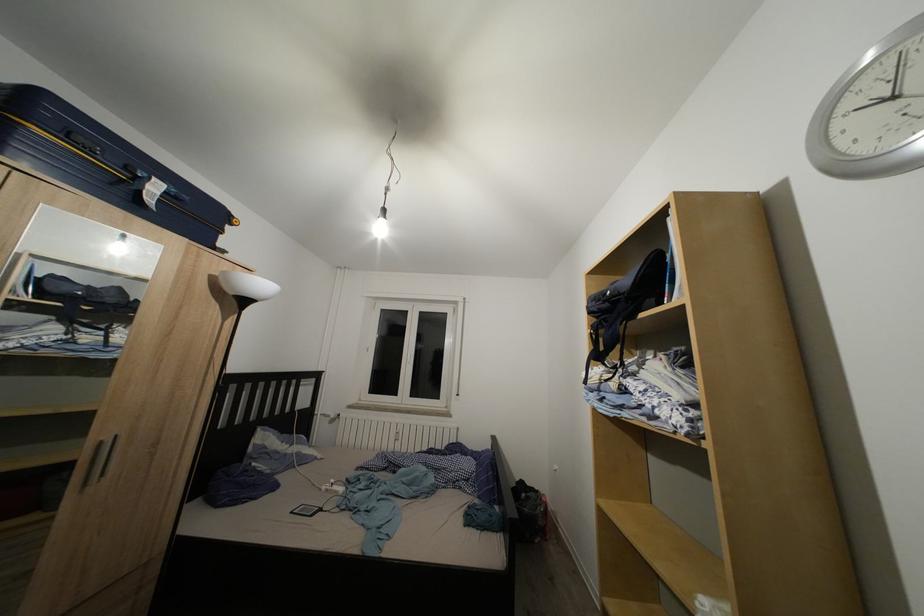
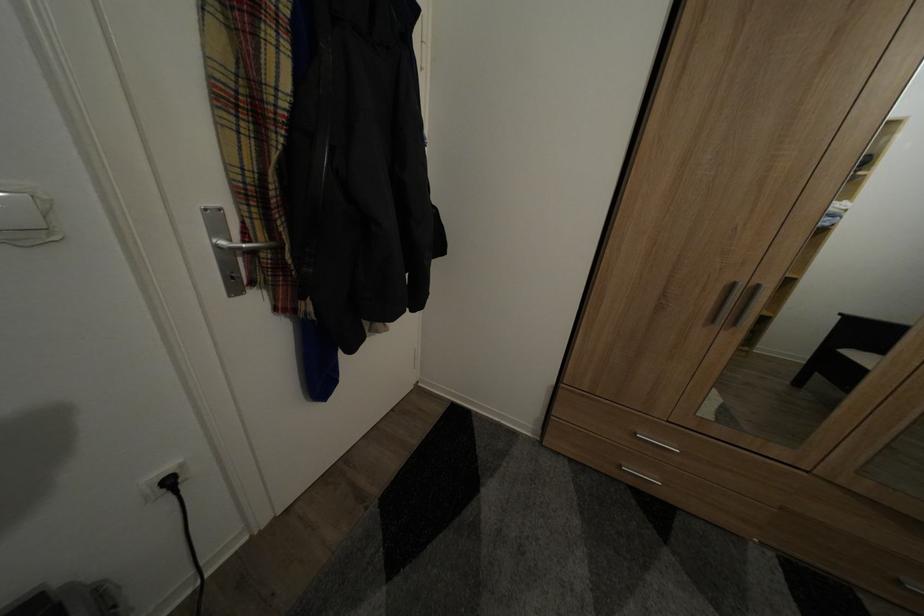
Question: The camera is either moving clockwise (left) or counter-clockwise (right) around the object. The first image is from the beginning of the video and the second image is from the end. Is the camera moving left or right when shooting the video?

Choices:
 (A) Left
 (B) Right

Answer: (B)